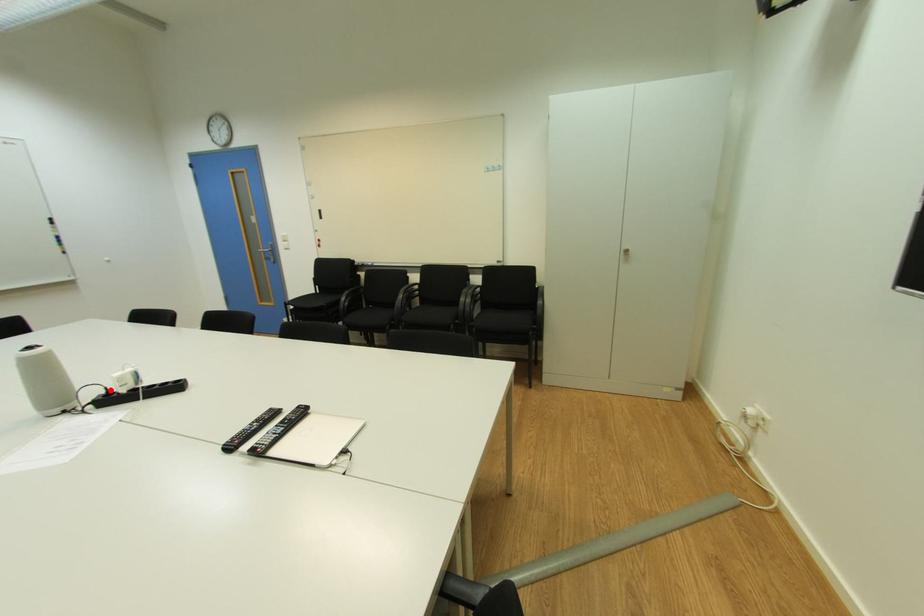
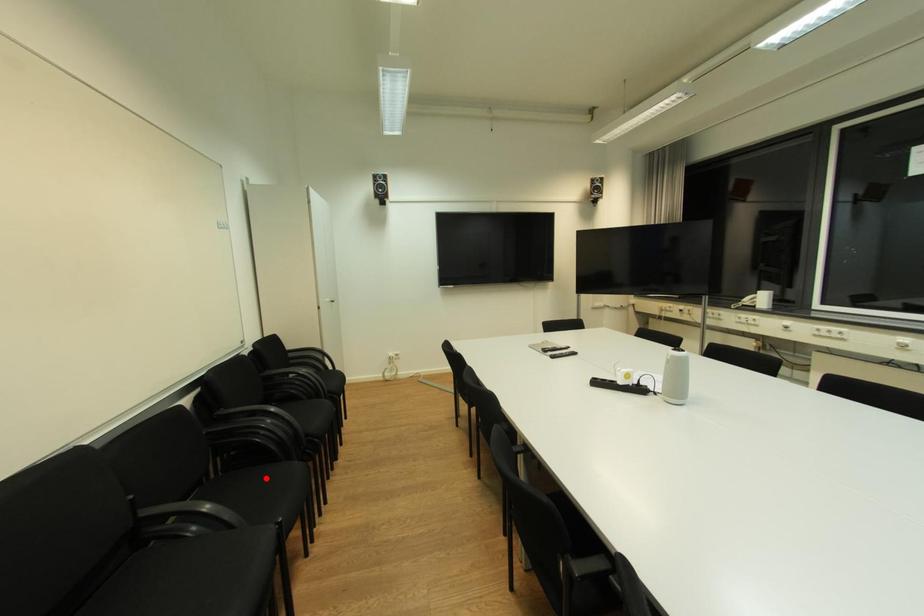
Looking at this image, I am providing you with two images of the same scene from different viewpoints. A red point is marked on the first image and another point is marked on the second image. Are the points marked in image1 and image2 representing the same 3D position?

No